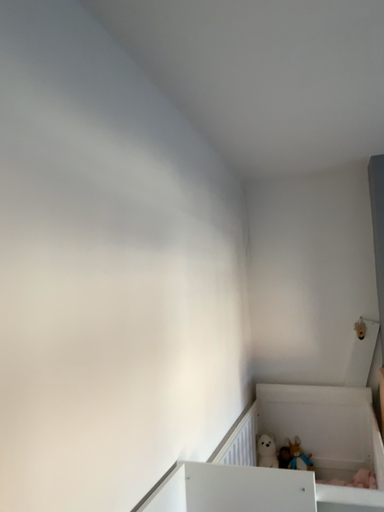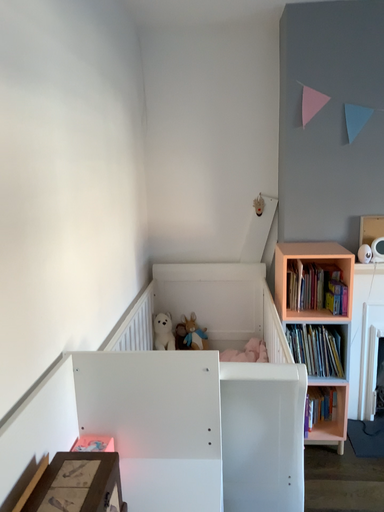
Question: How did the camera likely rotate when shooting the video?

Choices:
 (A) rotated upward
 (B) rotated downward

Answer: (B)